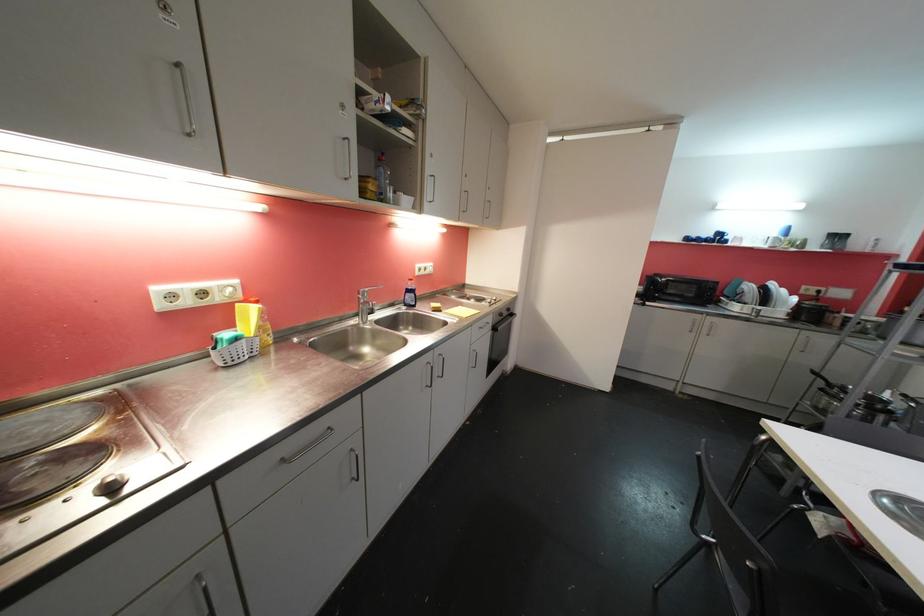
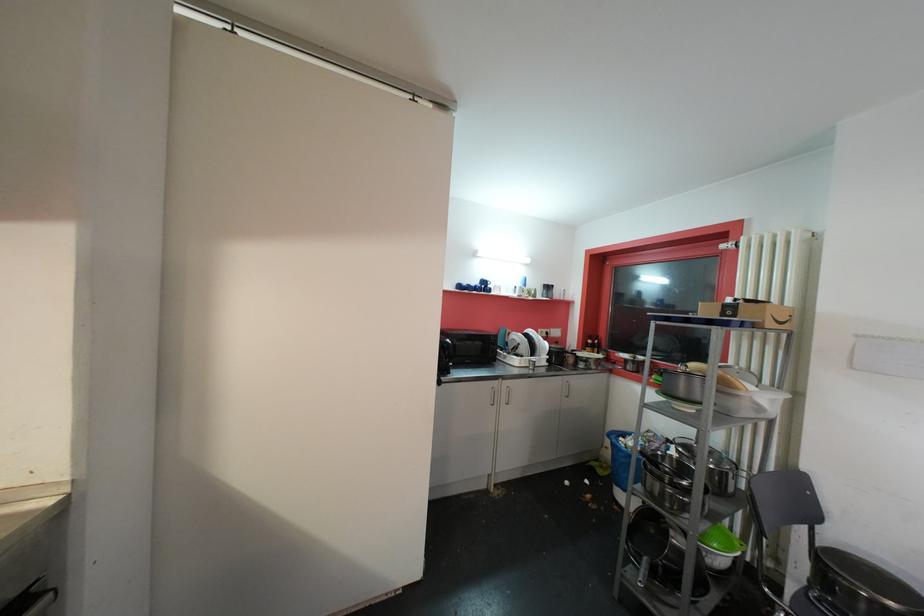
The point at [724,237] is marked in the first image. Where is the corresponding point in the second image?

(489, 285)